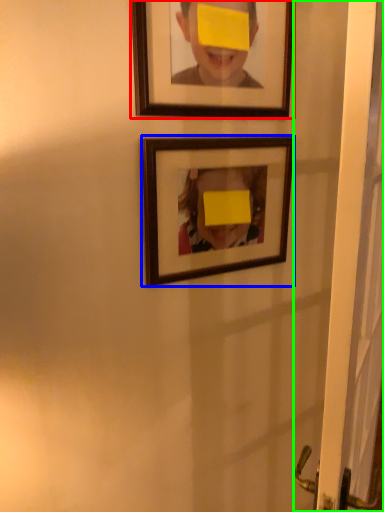
Question: Which object is positioned farthest from picture frame (highlighted by a red box)? Select from picture frame (highlighted by a blue box) and screen door (highlighted by a green box).

Choices:
 (A) picture frame
 (B) screen door

Answer: (B)